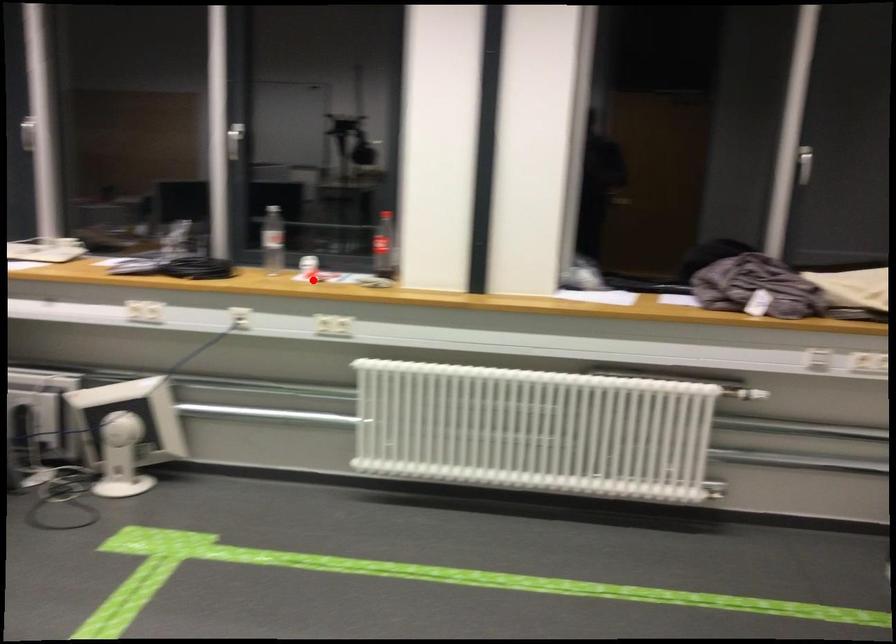
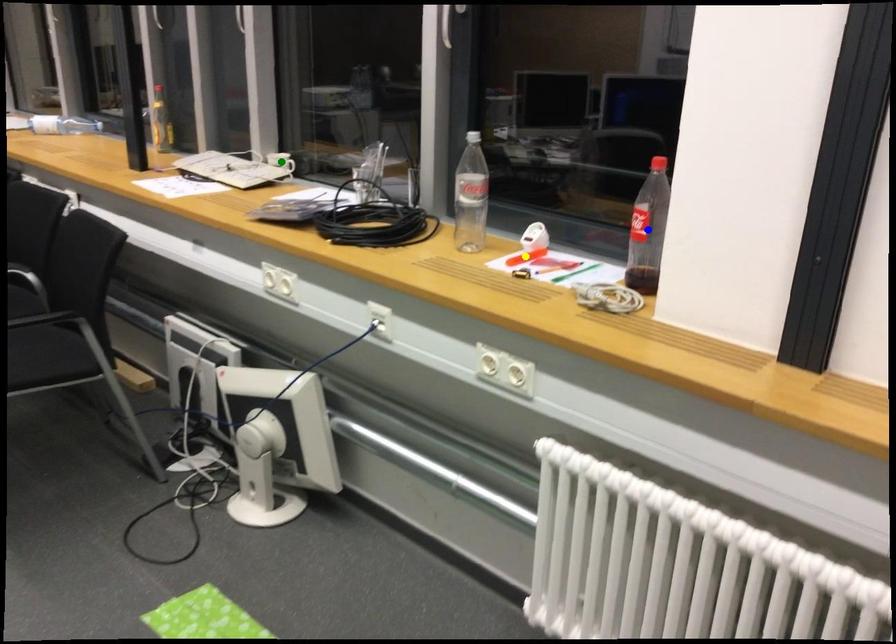
Question: I am providing you with two images of the same scene from different viewpoints. A red point is marked on the first image. You are given multiple points on the second image. Which mark in image 2 goes with the point in image 1?

Choices:
 (A) yellow point
 (B) green point
 (C) blue point

Answer: (A)